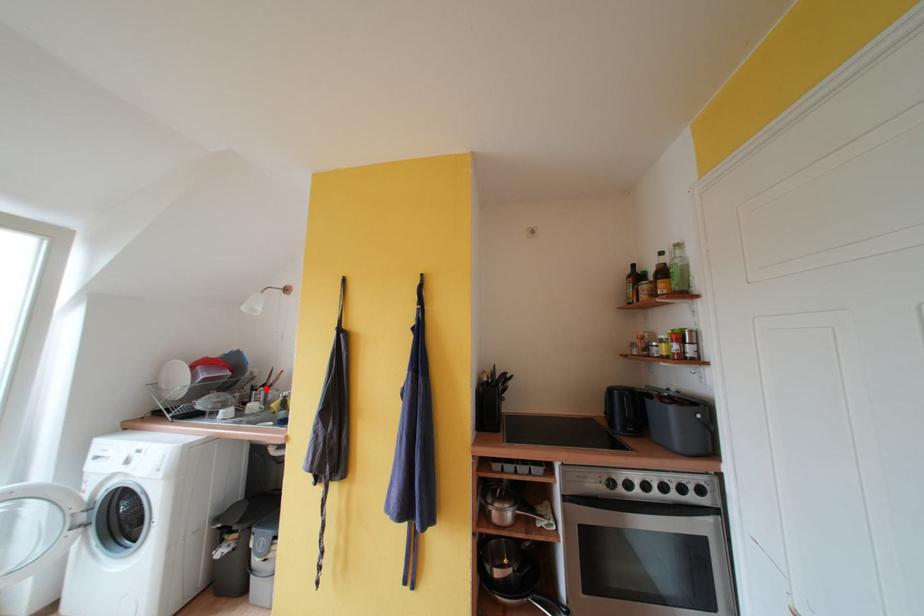
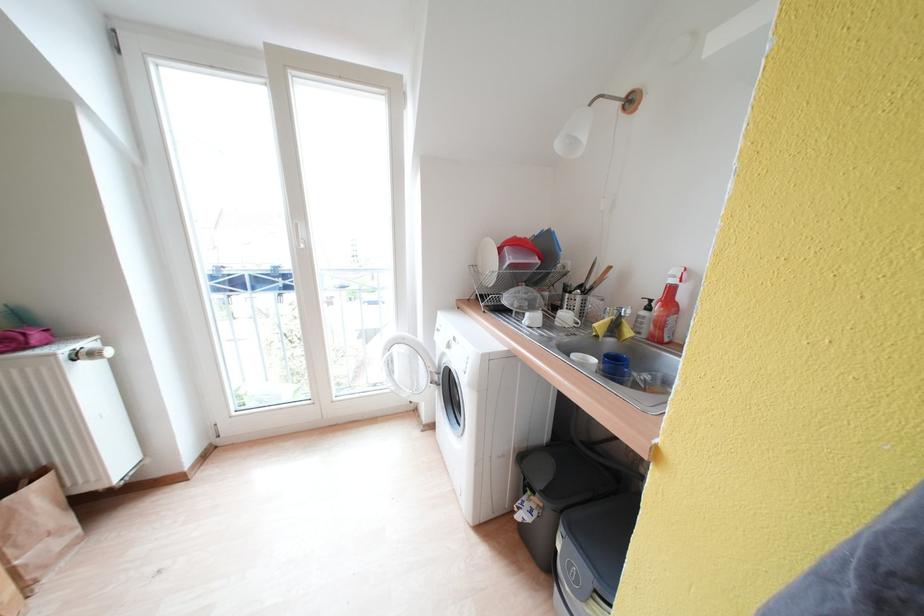
Locate, in the second image, the point that corresponds to the highlighted location in the first image.

(581, 289)